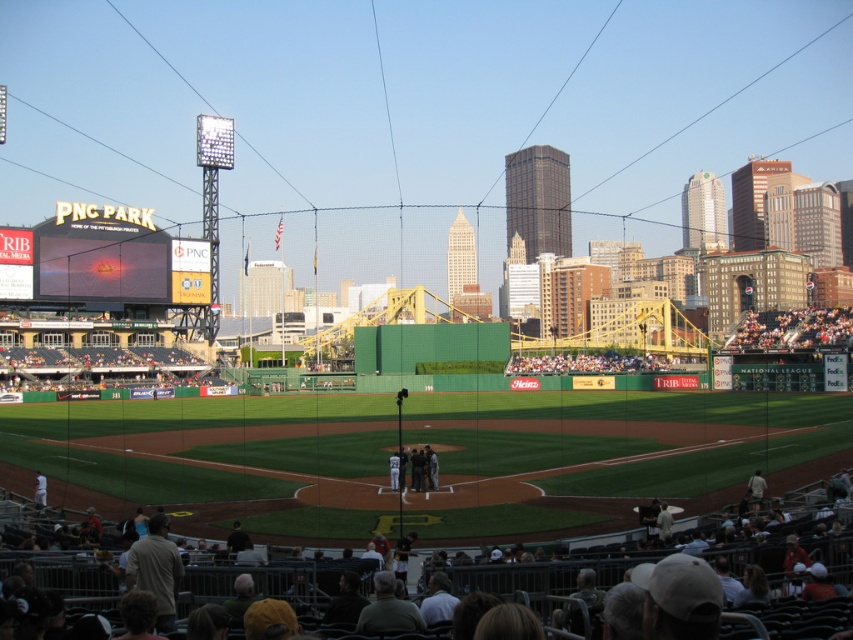
Is dark brown leather seats at lower center taller than dark brown wooden bench at upper right?

Incorrect, dark brown leather seats at lower center's height is not larger of dark brown wooden bench at upper right's.

Who is more forward, (323, 577) or (834, 317)?

Positioned in front is point (323, 577).

What are the coordinates of `dark brown leather seats at lower center` in the screenshot? It's located at (550, 582).

Consider the image. Does dark brown wooden bench at upper right have a lesser height compared to white uniformed players at center?

No.

Based on the photo, between dark brown wooden bench at upper right and white uniformed players at center, which one has less height?

Standing shorter between the two is white uniformed players at center.

Between point (775, 321) and point (428, 467), which one is positioned in front?

Point (428, 467) is in front.

Find the location of a particular element. dark brown wooden bench at upper right is located at coordinates (791, 330).

Does point (577, 573) lie in front of point (22, 278)?

That is True.

Can you confirm if dark brown leather seats at lower center is positioned below matte black scoreboard at upper left?

Yes, dark brown leather seats at lower center is below matte black scoreboard at upper left.

Is point (541, 577) less distant than point (99, 221)?

That is True.

This screenshot has width=853, height=640. Identify the location of dark brown leather seats at lower center. (550, 582).